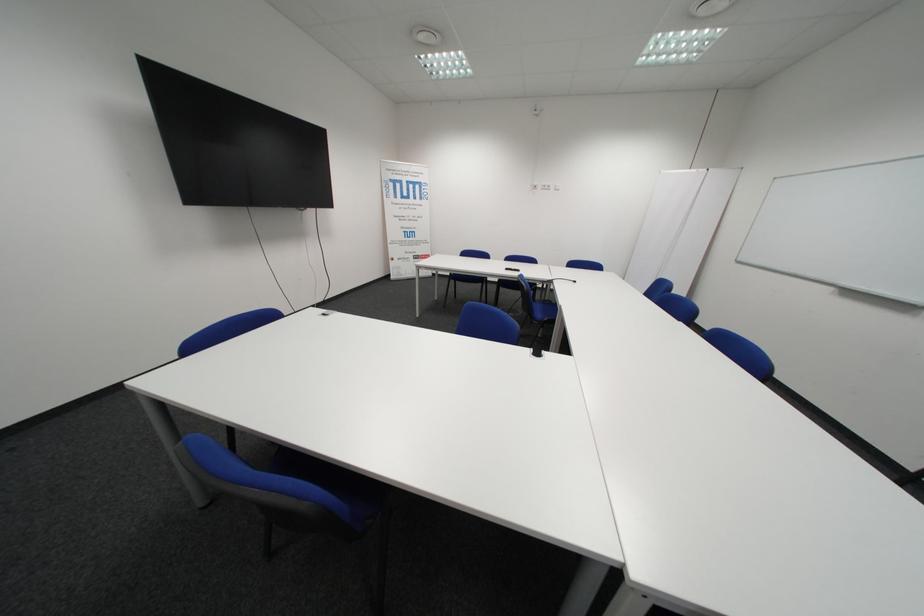
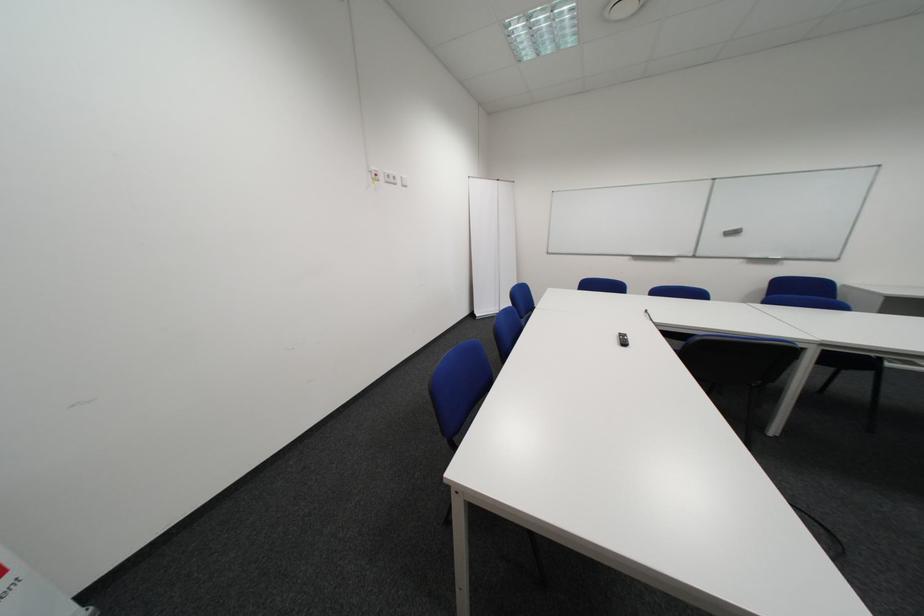
The point at (561, 187) is marked in the first image. Where is the corresponding point in the second image?

(407, 179)